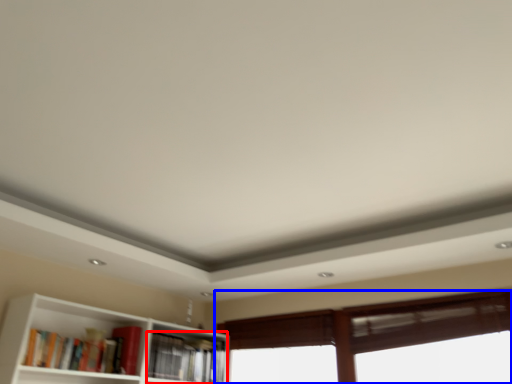
Question: Among these objects, which one is farthest to the camera, book (highlighted by a red box) or window (highlighted by a blue box)?

Choices:
 (A) book
 (B) window

Answer: (A)